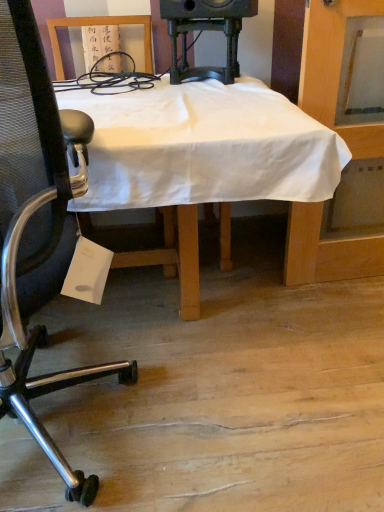
At what (x,y) coordinates should I click in order to perform the action: click on vacant area located to the right-hand side of metallic mesh chair at left. Please return your answer as a coordinate pair (x, y). Looking at the image, I should click on (232, 440).